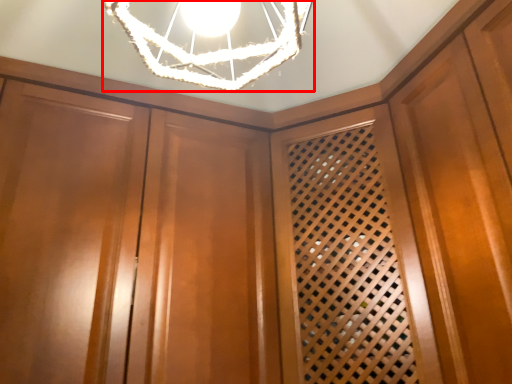
Question: From the image, what is the correct spatial relationship of lamp (annotated by the red box) in relation to cabinetry?

Choices:
 (A) right
 (B) left

Answer: (A)